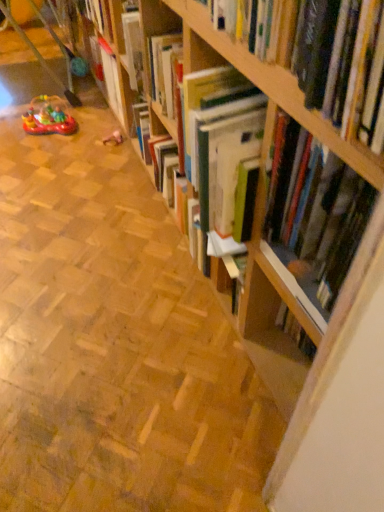
This screenshot has width=384, height=512. Find the location of `free space to the left of rubber boat at left, placed as the second toy when sorted from right to left`. free space to the left of rubber boat at left, placed as the second toy when sorted from right to left is located at coordinates (11, 124).